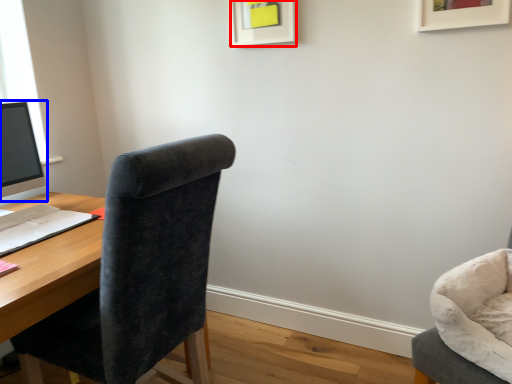
Question: Which object appears farthest to the camera in this image, picture frame (highlighted by a red box) or computer monitor (highlighted by a blue box)?

Choices:
 (A) picture frame
 (B) computer monitor

Answer: (A)